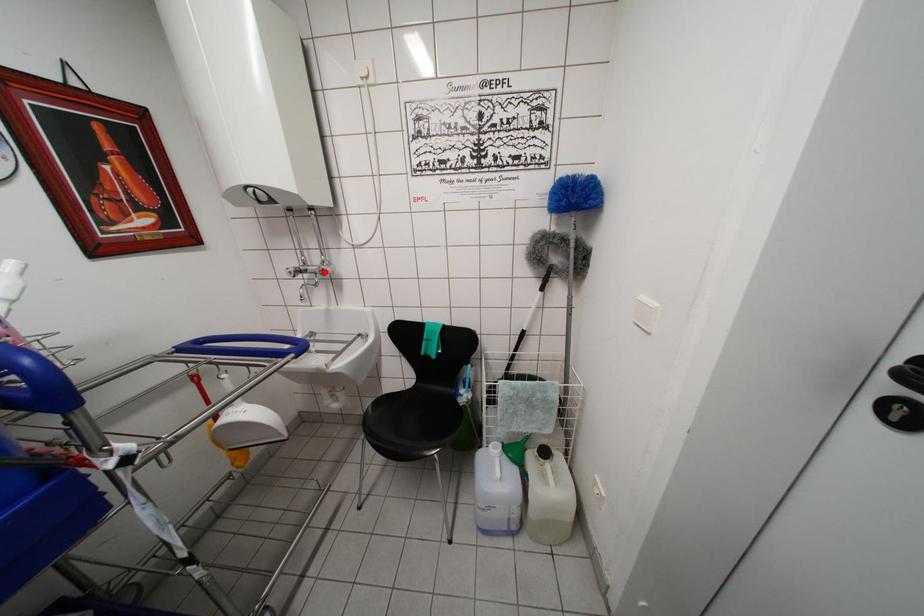
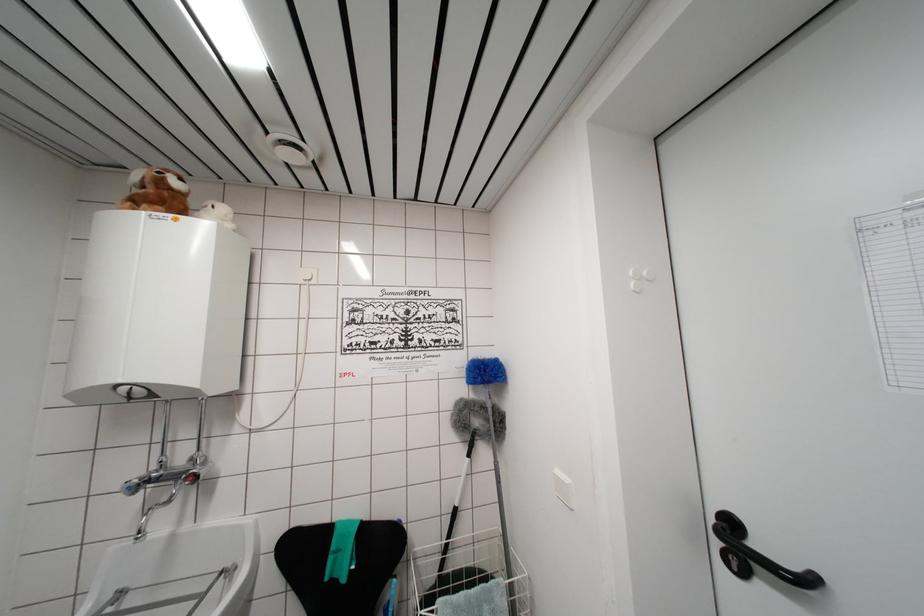
In the second image, find the point that corresponds to the highlighted location in the first image.

(197, 476)